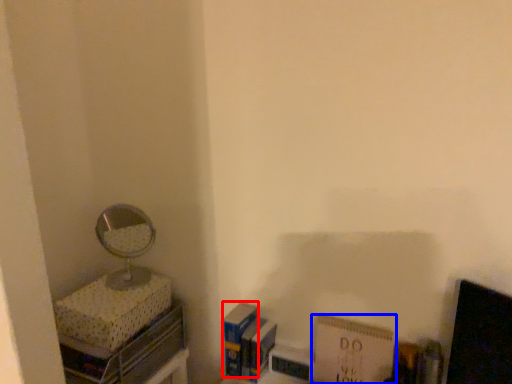
Question: Among these objects, which one is nearest to the camera, paperback book (highlighted by a red box) or paperback book (highlighted by a blue box)?

Choices:
 (A) paperback book
 (B) paperback book

Answer: (B)